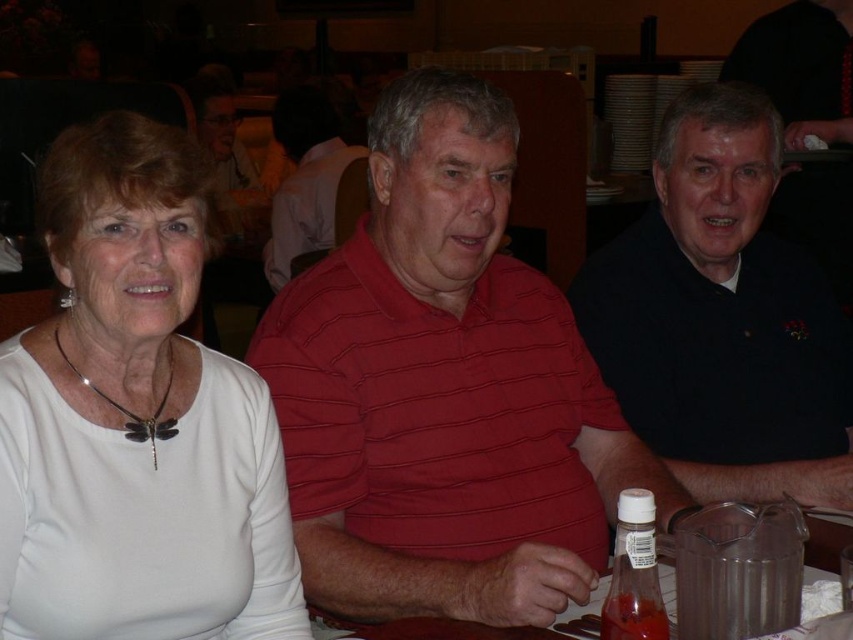
Question: Which point is farther to the camera?

Choices:
 (A) (326, 216)
 (B) (129, 362)

Answer: (A)

Question: In this image, where is striped cotton shirt at center located relative to red striped shirt at center?

Choices:
 (A) right
 (B) left

Answer: (A)

Question: Among these objects, which one is nearest to the camera?

Choices:
 (A) black smooth shirt at right
 (B) striped cotton shirt at center
 (C) red striped shirt at center
 (D) white matte shirt at left

Answer: (D)

Question: Does striped cotton shirt at center come in front of black smooth shirt at right?

Choices:
 (A) yes
 (B) no

Answer: (A)

Question: Which point is closer to the camera?

Choices:
 (A) white matte shirt at left
 (B) black smooth shirt at right
 (C) red striped shirt at center

Answer: (A)

Question: Is striped cotton shirt at center above red striped shirt at center?

Choices:
 (A) yes
 (B) no

Answer: (B)